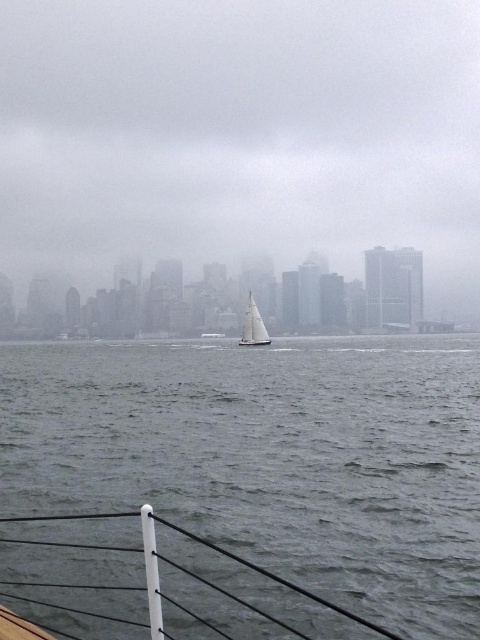
You are standing on a boat and looking at the scene. There is a white matte boat at lower center and a white matte sailboat at center. Which one is closer to you?

The white matte boat at lower center is closer to you because it is positioned below the white matte sailboat at center, indicating it is nearer in the visual hierarchy.

Based on the scene description, can you identify the object located at coordinates point (271, 456)?

The point (271, 456) indicates gray matte water at center.

You are a photographer trying to capture the white matte boat at lower center and the gray matte water at center in your shot. Which object appears taller in the frame?

The white matte boat at lower center appears taller than the gray matte water at center in the frame.